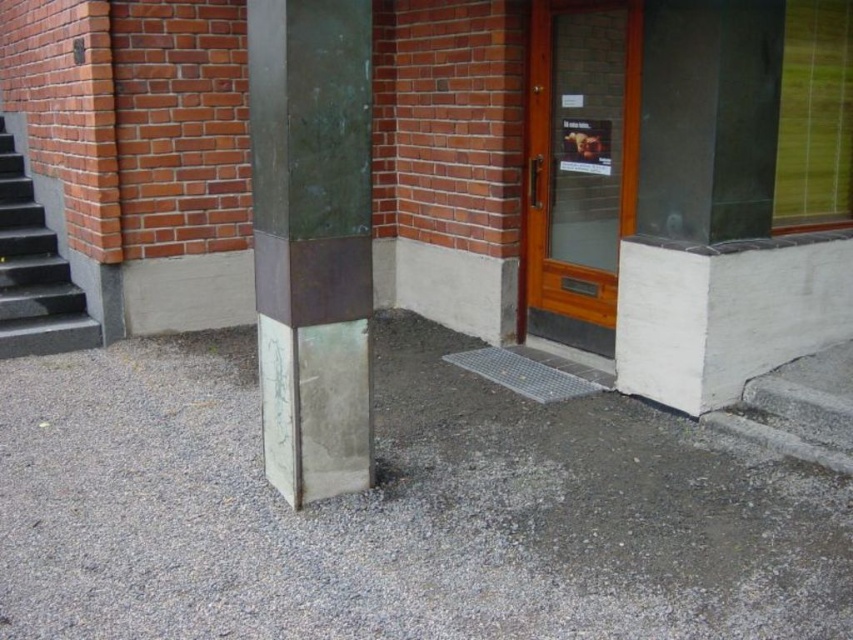
Where is `wooden door at center`? The height and width of the screenshot is (640, 853). wooden door at center is located at coordinates (579, 164).

Identify the location of wooden door at center. This screenshot has height=640, width=853. (579, 164).

Which of these two, green polished stone pillar at center or wooden door at center, stands shorter?

green polished stone pillar at center

Which is behind, point (323, 454) or point (567, 170)?

The point (567, 170) is more distant.

Image resolution: width=853 pixels, height=640 pixels. In order to click on green polished stone pillar at center in this screenshot , I will do `click(312, 241)`.

Does green polished stone pillar at center have a lesser height compared to black polished concrete stairs at left?

In fact, green polished stone pillar at center may be taller than black polished concrete stairs at left.

Does green polished stone pillar at center appear on the right side of black polished concrete stairs at left?

Indeed, green polished stone pillar at center is positioned on the right side of black polished concrete stairs at left.

Locate an element on the screen. green polished stone pillar at center is located at coordinates (312, 241).

I want to click on green polished stone pillar at center, so click(312, 241).